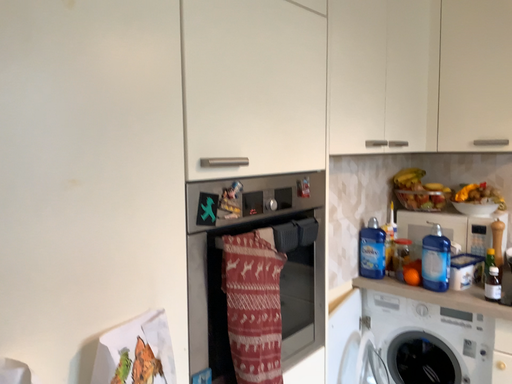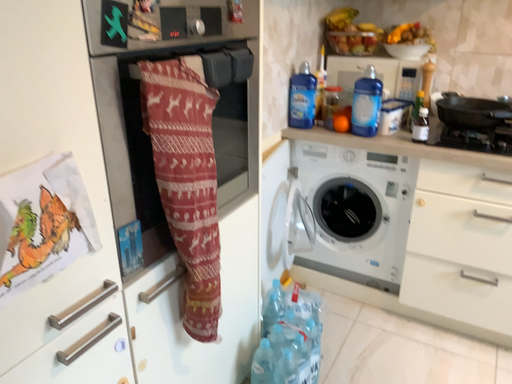
Question: Which way did the camera rotate in the video?

Choices:
 (A) rotated left
 (B) rotated right

Answer: (B)